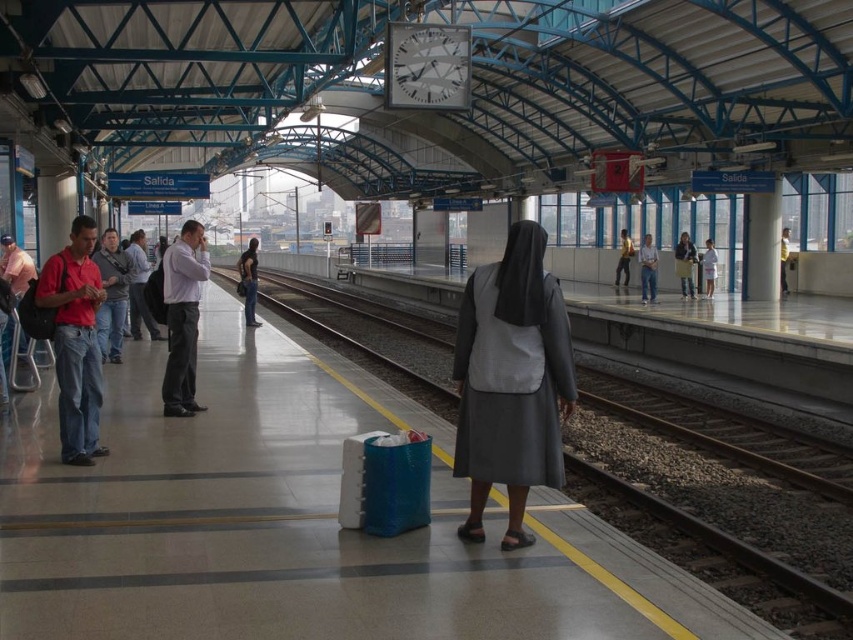
Question: Does dark gray fabric nun at center have a greater width compared to jeans at center?

Choices:
 (A) no
 (B) yes

Answer: (B)

Question: Estimate the real-world distances between objects in this image. Which object is closer to the jeans at center?

Choices:
 (A) gray matte nun's habit at center
 (B) metallic silver clock at upper center
 (C) smooth metal train track at center

Answer: (C)

Question: Which point is farther to the camera?

Choices:
 (A) (248, 285)
 (B) (564, 417)
 (C) (613, 440)

Answer: (A)

Question: Does smooth metal train track at center have a lesser width compared to gray matte nun's habit at center?

Choices:
 (A) no
 (B) yes

Answer: (A)

Question: Does smooth metal train track at center have a smaller size compared to metallic silver clock at upper center?

Choices:
 (A) no
 (B) yes

Answer: (A)

Question: Which point appears farthest from the camera in this image?

Choices:
 (A) (254, 278)
 (B) (512, 394)
 (C) (758, 536)

Answer: (A)